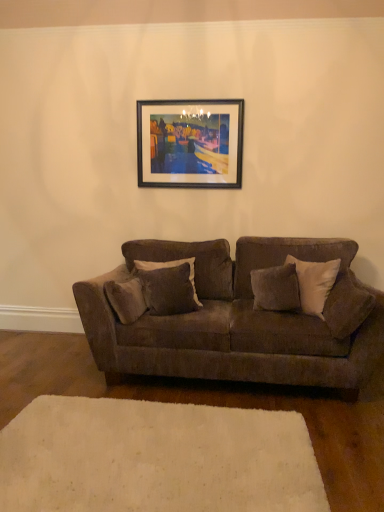
Question: Is point (349, 278) positioned closer to the camera than point (192, 272)?

Choices:
 (A) closer
 (B) farther

Answer: (A)

Question: In terms of height, does soft gray fabric pillow at right, which is the first pillow in right-to-left order, look taller or shorter compared to velvet gray pillow at center, the first pillow positioned from the left?

Choices:
 (A) short
 (B) tall

Answer: (B)

Question: Based on their relative distances, which object is farther from the wooden-framed artwork at upper center?

Choices:
 (A) soft gray fabric pillow at right, the 3th pillow in the left-to-right sequence
 (B) white soft rug at lower center
 (C) velvet gray pillow at center, the first pillow positioned from the left
 (D) velvet brown couch at center
 (E) velvety brown pillow at center, the 2th pillow from the left

Answer: (B)

Question: Which of these objects is positioned farthest from the velvety brown pillow at center, the 2th pillow from the left?

Choices:
 (A) velvet gray pillow at center, the first pillow positioned from the left
 (B) wooden-framed artwork at upper center
 (C) white soft rug at lower center
 (D) soft gray fabric pillow at right, which is the first pillow in right-to-left order
 (E) velvet brown couch at center

Answer: (C)